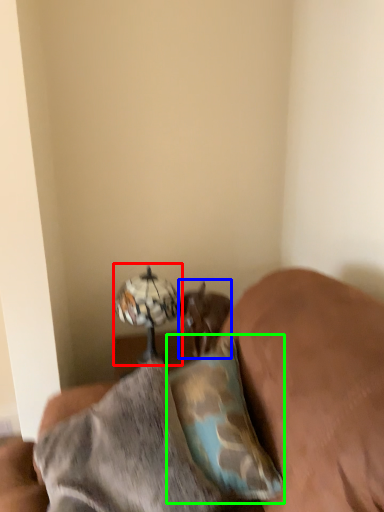
Question: Which is farther away from table lamp (highlighted by a red box)? animal (highlighted by a blue box) or pillow (highlighted by a green box)?

Choices:
 (A) animal
 (B) pillow

Answer: (B)